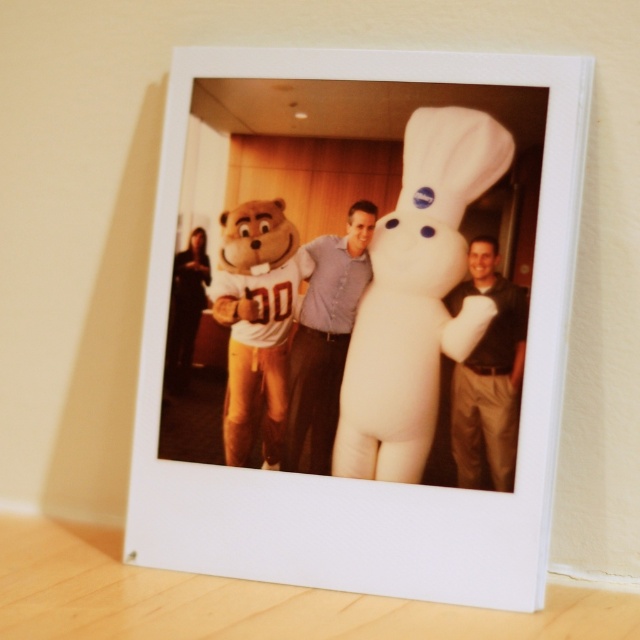
You are standing at the camera position and want to reach the point marked as point [435,296] in the image. If your average step length is 30 inches, how many steps do you need to take to reach that point?

The distance between the point [435,296] and the camera is 35.67 inches. Since each step is 30 inches, you would need to take 2 steps to cover the distance, as 35.67 inches divided by 30 inches per step equals approximately 1.19 steps, which rounds up to 2 steps.

You are organizing a mascot costume storage area. You have two items to place on a shelf that can only hold one of them due to size constraints. The items are the white plush at center and the dark brown leather jacket at center. Which item should you choose to fit on the shelf?

The white plush at center has a larger size compared to the dark brown leather jacket at center, so you should choose the dark brown leather jacket at center to fit on the shelf.

You are a photographer setting up a tripod in the center of the room. You need to ensure that both the white plush at center and the dark brown leather jacket at center are visible in your shot. Given their sizes, which object might require you to adjust your camera angle to avoid blocking the smaller one?

The dark brown leather jacket at center is shorter than the white plush at center. To ensure both are visible, you may need to angle the camera slightly downward to avoid the white plush at center blocking the dark brown leather jacket at center.